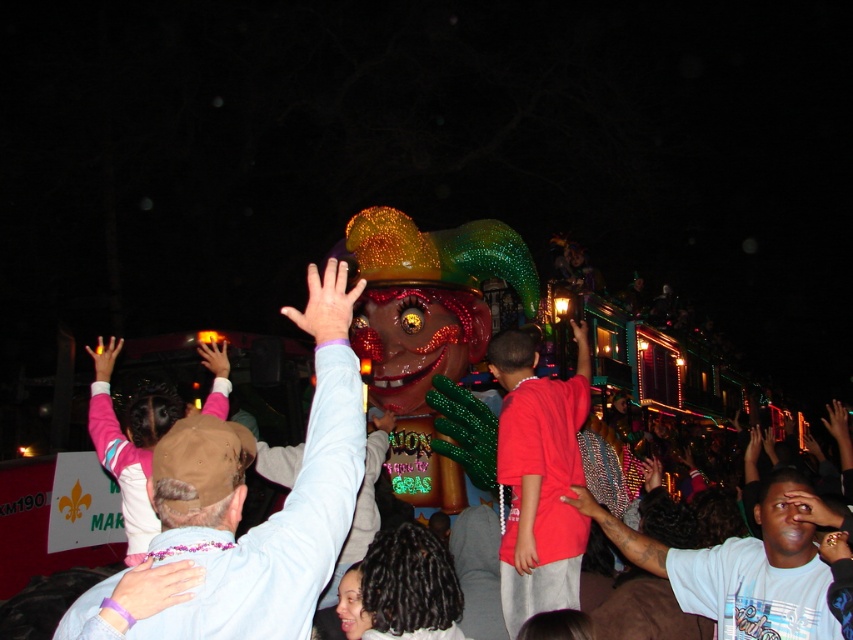
Can you confirm if red matte shirt at center is smaller than pink fleece jacket at upper left?

Yes, red matte shirt at center is smaller than pink fleece jacket at upper left.

Which is behind, point (520, 529) or point (117, 420)?

The point (117, 420) is behind.

Does point (505, 563) come closer to viewer compared to point (107, 422)?

No, (505, 563) is further to viewer.

Locate an element on the screen. red matte shirt at center is located at coordinates (538, 476).

Is the position of red matte shirt at center more distant than that of white t-shirt at center?

Yes.

Does point (515, 512) lie behind point (836, 621)?

That is True.

Find the location of a particular element. This screenshot has width=853, height=640. red matte shirt at center is located at coordinates (538, 476).

Does light blue cotton shirt at upper center lie in front of red matte shirt at center?

Yes, it is.

Does light blue cotton shirt at upper center come behind red matte shirt at center?

No.

Is point (196, 417) in front of point (577, 531)?

Yes.

The image size is (853, 640). Find the location of `light blue cotton shirt at upper center`. light blue cotton shirt at upper center is located at coordinates (242, 500).